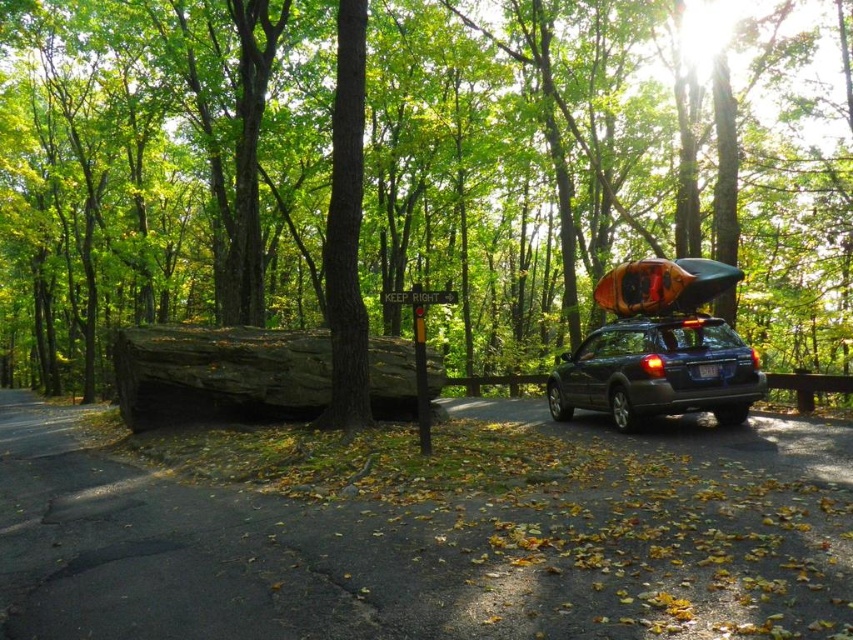
Looking at this image, you are standing on the forest path and see two points marked on the ground. The first point is at coordinate point(635, 122) and the second is at point(292, 342). Which point is closer to you?

Point(292, 342) is closer to you because it is less further to the camera than point(635, 122).